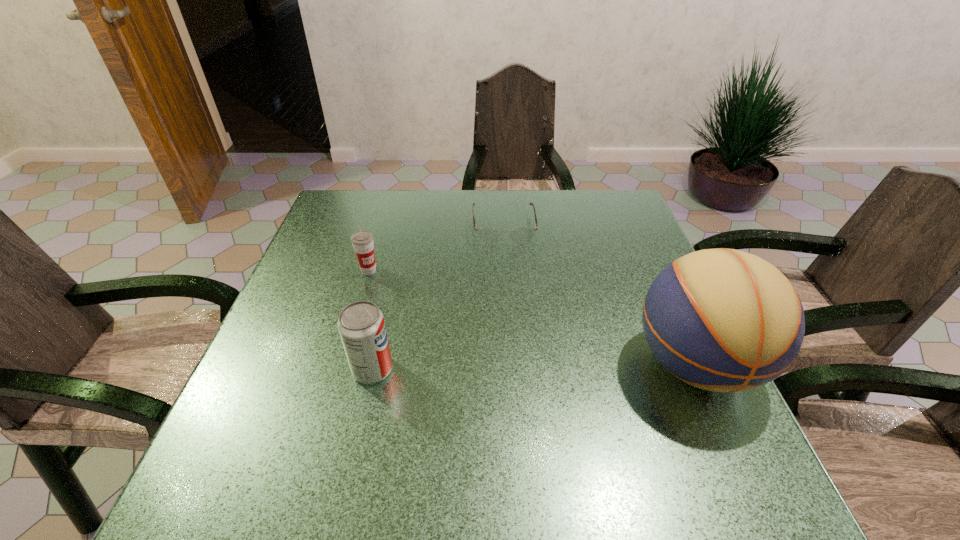
Locate an element on the screen. blank region between the basketball and the soda is located at coordinates (534, 367).

What are the coordinates of `free area in between the farthest object and the soda` in the screenshot? It's located at (438, 298).

Identify the location of free spot between the rightmost object and the soda. (534, 367).

In order to click on free area in between the spectacles and the soda in this screenshot , I will do `click(438, 298)`.

Image resolution: width=960 pixels, height=540 pixels. In order to click on free area in between the cup and the shortest object in this screenshot , I will do `click(436, 249)`.

Where is `the closest object relative to the rightmost object`? Image resolution: width=960 pixels, height=540 pixels. the closest object relative to the rightmost object is located at coordinates (489, 236).

Point out which object is positioned as the second nearest to the second object from right to left. Please provide its 2D coordinates. Your answer should be formatted as a tuple, i.e. [(x, y)], where the tuple contains the x and y coordinates of a point satisfying the conditions above.

[(723, 320)]

Where is `vacant space that satisfies the following two spatial constraints: 1. on the front side of the soda; 2. on the right side of the cup`? Image resolution: width=960 pixels, height=540 pixels. vacant space that satisfies the following two spatial constraints: 1. on the front side of the soda; 2. on the right side of the cup is located at coordinates (340, 369).

This screenshot has width=960, height=540. Identify the location of free space that satisfies the following two spatial constraints: 1. on the front side of the cup; 2. on the left side of the soda. (340, 369).